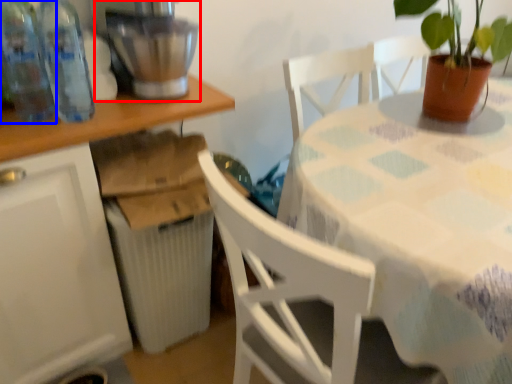
Question: Which object is further to the camera taking this photo, mixer (highlighted by a red box) or bottle (highlighted by a blue box)?

Choices:
 (A) mixer
 (B) bottle

Answer: (A)